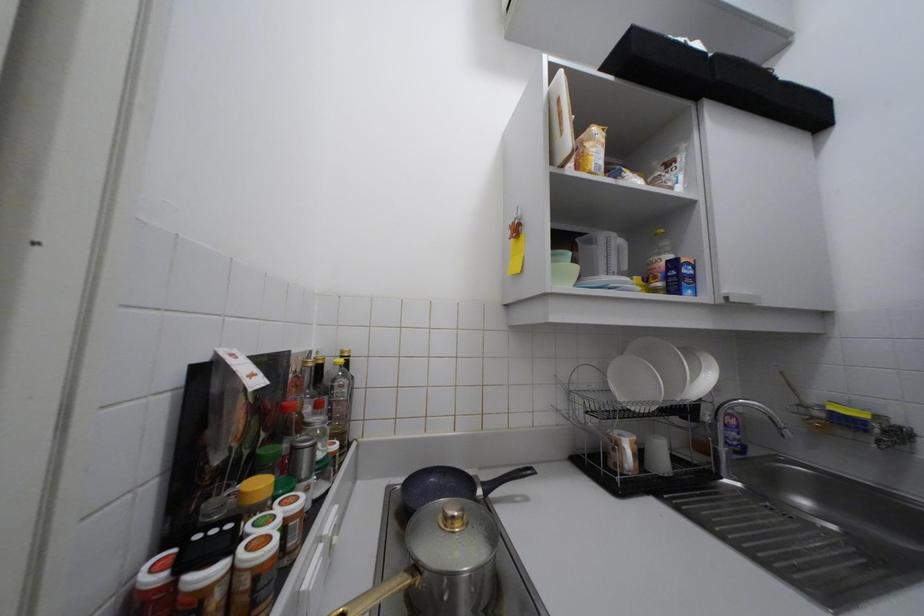
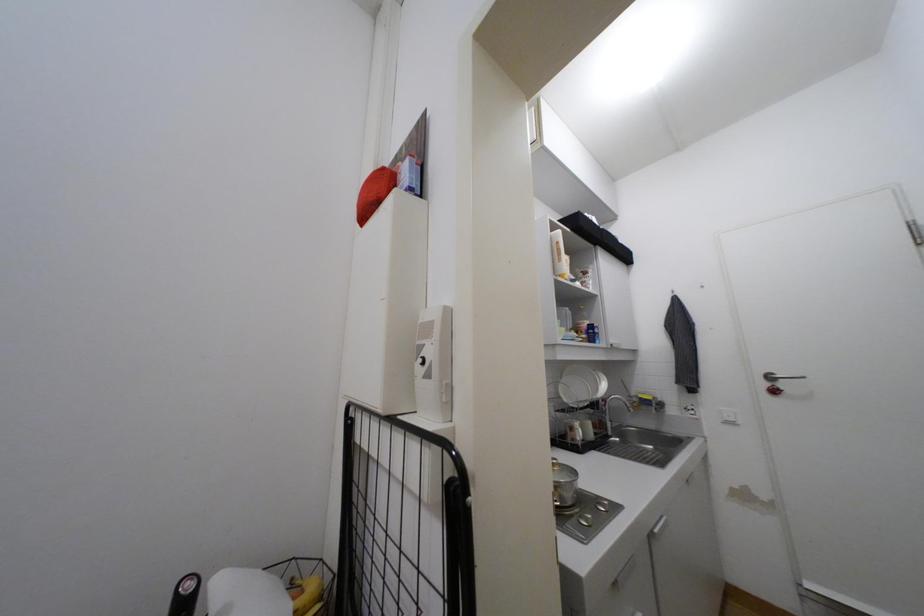
Question: Which direction would the cameraman need to move to produce the second image? Reply with the corresponding letter.

Choices:
 (A) Left
 (B) Right
 (C) Forward
 (D) Backward

Answer: (A)